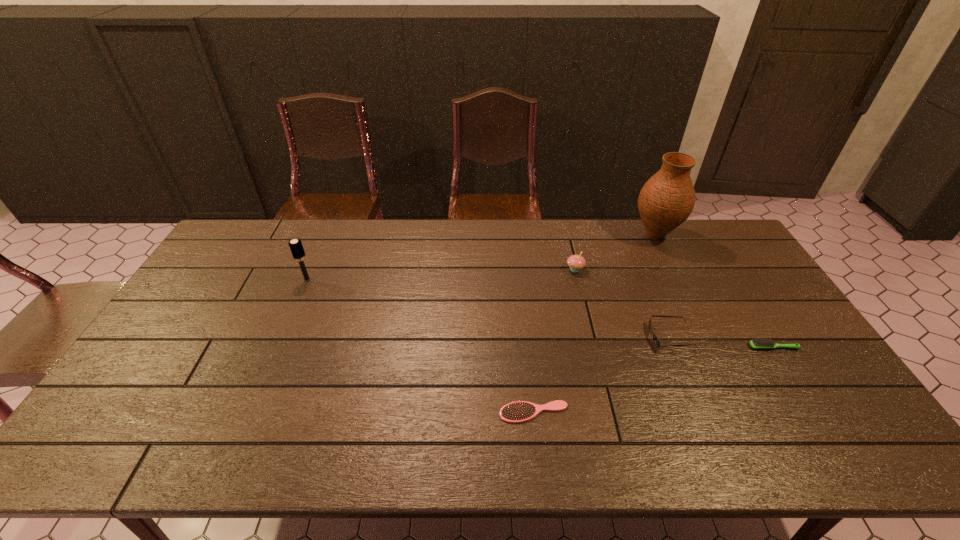
I want to click on empty location between the rightmost object and the fourth shortest object, so click(674, 308).

Where is `free space between the rightmost hairbrush and the vase`? free space between the rightmost hairbrush and the vase is located at coordinates (714, 291).

Find the location of a particular element. The width and height of the screenshot is (960, 540). empty location between the sunglasses and the fourth object from right to left is located at coordinates (623, 303).

Identify the location of vacant region between the farthest object and the sunglasses. coord(663,287).

This screenshot has width=960, height=540. What are the coordinates of `empty space that is in between the fourth tallest object and the second object from left to right` in the screenshot? It's located at (602, 375).

The image size is (960, 540). I want to click on object that is the fourth closest to the rightmost hairbrush, so click(520, 411).

Locate which object ranks fifth in proximity to the sunglasses. Please provide its 2D coordinates. Your answer should be formatted as a tuple, i.e. [(x, y)], where the tuple contains the x and y coordinates of a point satisfying the conditions above.

[(296, 247)]

Find the location of a particular element. This screenshot has width=960, height=540. hairbrush identified as the third closest to the fourth object from right to left is located at coordinates (296, 247).

Identify which hairbrush is located as the nearest to the leftmost object. Please provide its 2D coordinates. Your answer should be formatted as a tuple, i.e. [(x, y)], where the tuple contains the x and y coordinates of a point satisfying the conditions above.

[(520, 411)]

Locate an element on the screen. vacant space that satisfies the following two spatial constraints: 1. on the lenses of the third shortest object; 2. on the right side of the rightmost hairbrush is located at coordinates (675, 347).